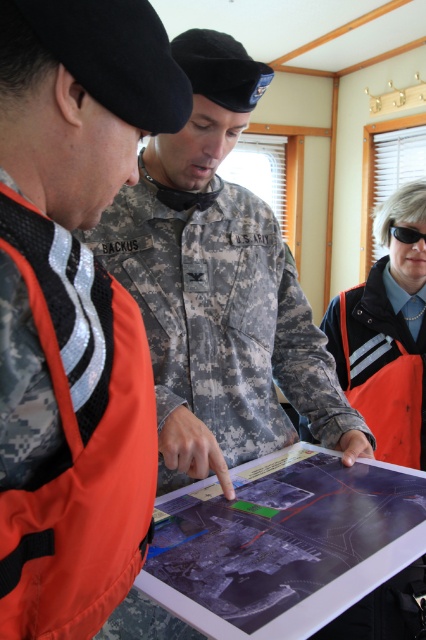
Question: Among these objects, which one is nearest to the camera?

Choices:
 (A) camouflage uniform at center
 (B) orange reflective vest at center

Answer: (A)

Question: Which point is closer to the camera taking this photo?

Choices:
 (A) (388, 230)
 (B) (19, 212)

Answer: (B)

Question: Observing the image, what is the correct spatial positioning of orange fabric life jacket at left in reference to black plastic goggles at center?

Choices:
 (A) left
 (B) right

Answer: (A)

Question: Which object is the farthest from the orange fabric life jacket at left?

Choices:
 (A) orange reflective vest at center
 (B) camouflage uniform at center
 (C) black plastic goggles at center

Answer: (C)

Question: From the image, what is the correct spatial relationship of orange fabric life jacket at left in relation to orange reflective vest at center?

Choices:
 (A) below
 (B) above

Answer: (A)

Question: Is camouflage uniform at center behind orange reflective vest at center?

Choices:
 (A) no
 (B) yes

Answer: (A)